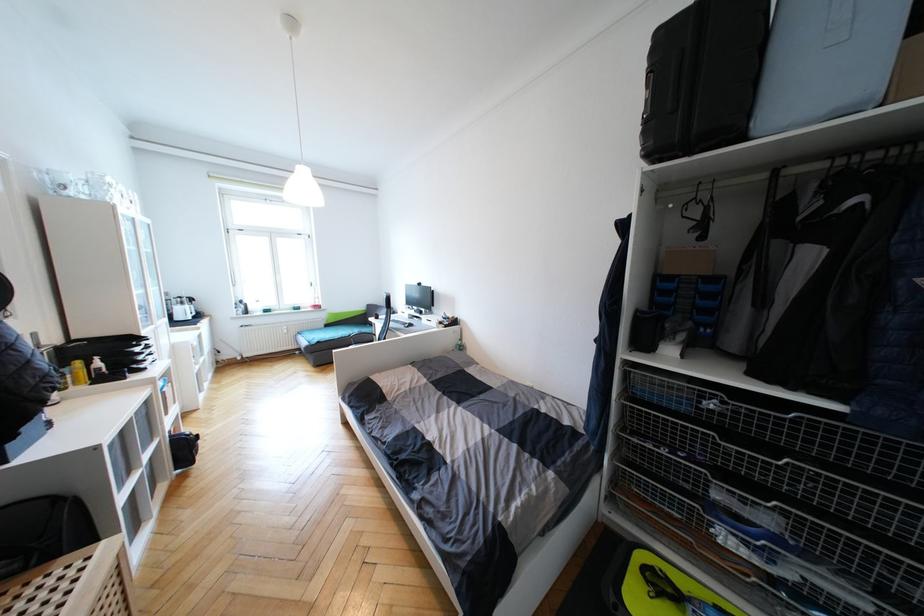
Locate an element on the screen. This screenshot has height=616, width=924. grey fabric bin is located at coordinates (913, 22).